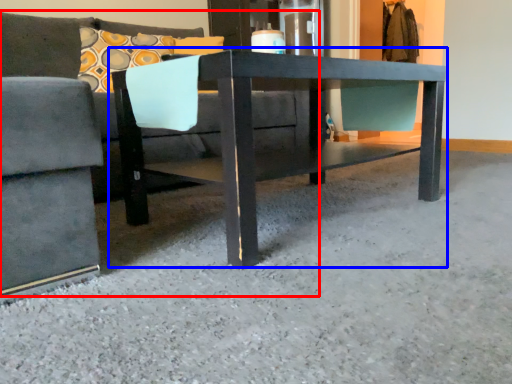
Question: Which object is further to the camera taking this photo, studio couch (highlighted by a red box) or table (highlighted by a blue box)?

Choices:
 (A) studio couch
 (B) table

Answer: (B)